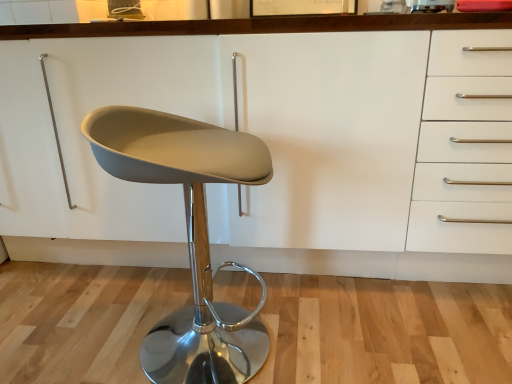
The height and width of the screenshot is (384, 512). Find the location of `vacant area that is situated to the right of matte gray seat at center`. vacant area that is situated to the right of matte gray seat at center is located at coordinates (330, 332).